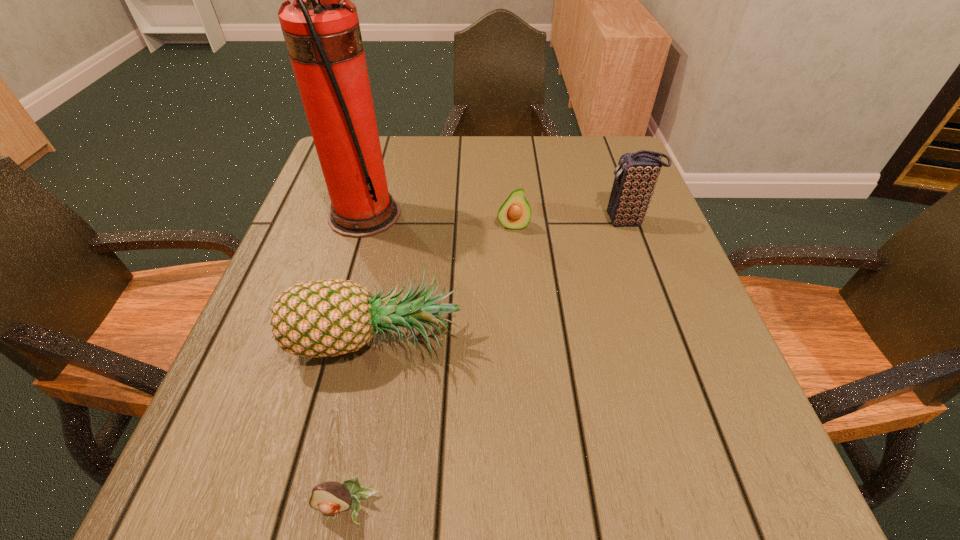
The image size is (960, 540). What are the coordinates of `vacant position at the left edge of the desktop` in the screenshot? It's located at (288, 377).

In the image, there is a desktop. Where is `vacant space at the right edge`? Image resolution: width=960 pixels, height=540 pixels. vacant space at the right edge is located at coordinates (694, 386).

You are a GUI agent. You are given a task and a screenshot of the screen. Output one action in this format:
    pyautogui.click(x=<x>, y=<y>)
    Task: Click on the vacant space at the far right corner of the desktop
    This screenshot has height=540, width=960.
    Given the screenshot: What is the action you would take?
    pyautogui.click(x=594, y=166)

The width and height of the screenshot is (960, 540). Identify the location of blank space at the near right corner. (718, 457).

This screenshot has width=960, height=540. I want to click on vacant space that's between the fourth farthest object and the tallest object, so click(371, 276).

The width and height of the screenshot is (960, 540). I want to click on free space between the second nearest object and the tallest object, so click(371, 276).

You are a GUI agent. You are given a task and a screenshot of the screen. Output one action in this format:
    pyautogui.click(x=<x>, y=<y>)
    Task: Click on the unoccupied area between the rightmost object and the fire extinguisher
    The width and height of the screenshot is (960, 540).
    Given the screenshot: What is the action you would take?
    pyautogui.click(x=495, y=218)

At what (x,y) coordinates should I click in order to perform the action: click on vacant space that is in between the third tallest object and the second object from right to left. Please return your answer as a coordinate pair (x, y). Image resolution: width=960 pixels, height=540 pixels. Looking at the image, I should click on (445, 281).

Where is `unoccupied position between the second nearest object and the clutch bag`? The height and width of the screenshot is (540, 960). unoccupied position between the second nearest object and the clutch bag is located at coordinates (502, 279).

Locate an element on the screen. The height and width of the screenshot is (540, 960). vacant area that lies between the rightmost object and the fire extinguisher is located at coordinates (495, 218).